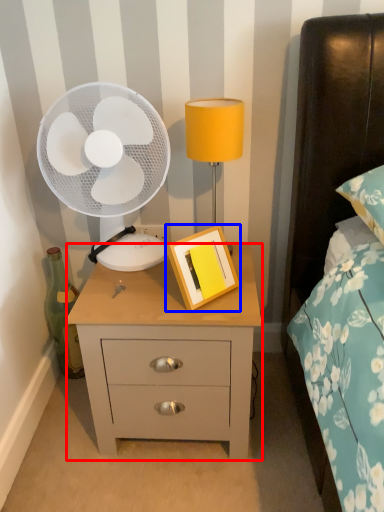
Question: Among these objects, which one is nearest to the camera, nightstand (highlighted by a red box) or picture frame (highlighted by a blue box)?

Choices:
 (A) nightstand
 (B) picture frame

Answer: (B)